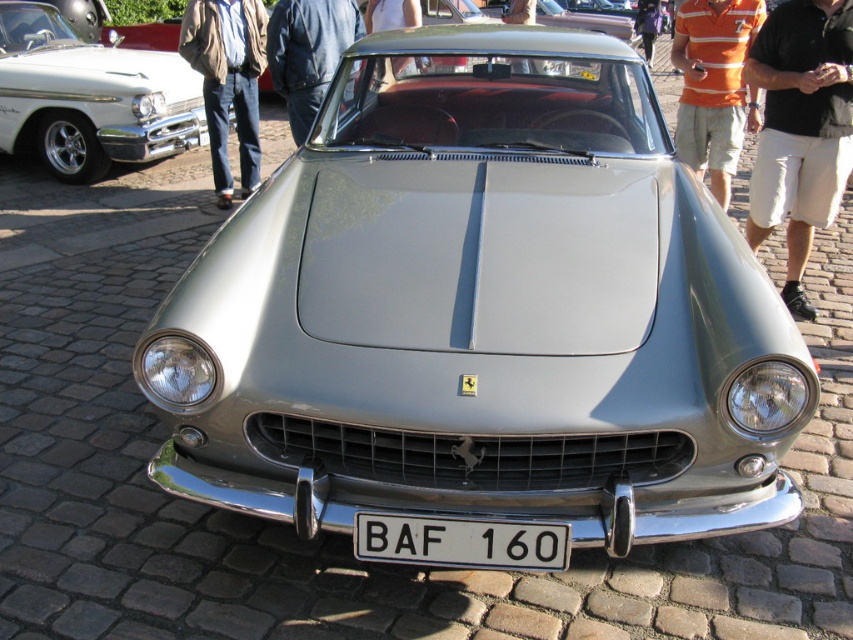
Question: Considering the relative positions of black cotton shirt at center and white plastic license plate at center in the image provided, where is black cotton shirt at center located with respect to white plastic license plate at center?

Choices:
 (A) left
 (B) right

Answer: (B)

Question: Can you confirm if dark blue leather jacket at center is smaller than light blue fabric pants at center?

Choices:
 (A) yes
 (B) no

Answer: (B)

Question: Does black cotton shirt at center have a larger size compared to light blue fabric pants at center?

Choices:
 (A) yes
 (B) no

Answer: (A)

Question: Which of these objects is positioned farthest from the dark blue leather jacket at center?

Choices:
 (A) white glossy sedan at left
 (B) denim pants at center
 (C) light blue fabric pants at center

Answer: (A)

Question: Estimate the real-world distances between objects in this image. Which object is farther from the denim pants at center?

Choices:
 (A) orange striped polo shirt at upper center
 (B) white glossy sedan at left
 (C) dark blue leather jacket at center
 (D) black cotton shirt at center

Answer: (D)

Question: Which is farther from the black cotton shirt at center?

Choices:
 (A) denim pants at center
 (B) light blue fabric pants at center

Answer: (A)